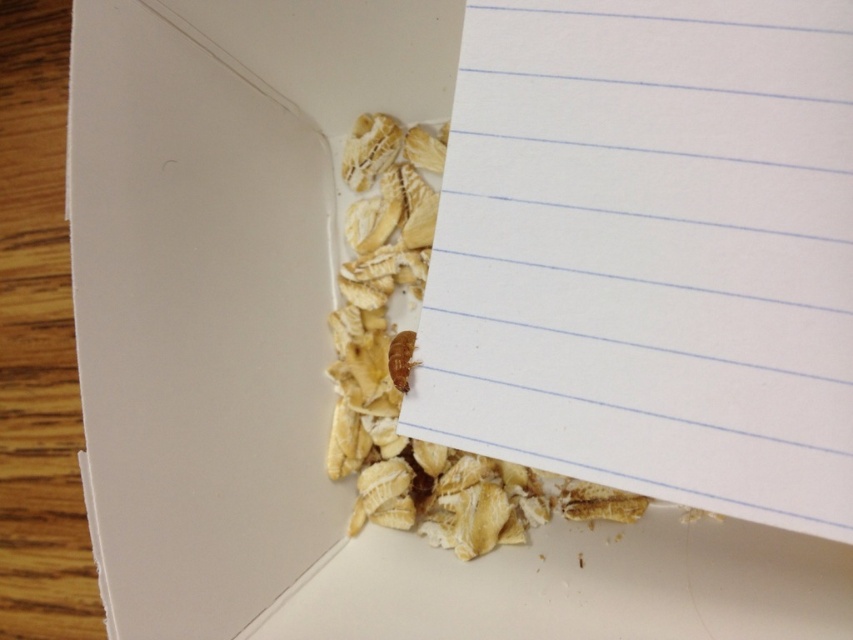
Question: From the image, what is the correct spatial relationship of white lined paper at center in relation to brown crumb at lower center?

Choices:
 (A) above
 (B) below

Answer: (A)

Question: Which point is closer to the camera?

Choices:
 (A) (579, 556)
 (B) (809, 188)
 (C) (398, 352)

Answer: (B)

Question: Can you confirm if white lined paper at center is positioned below brown crumb at lower center?

Choices:
 (A) no
 (B) yes

Answer: (A)

Question: Which object appears farthest from the camera in this image?

Choices:
 (A) brown crumb at lower center
 (B) brown matte nut at center
 (C) white lined paper at center

Answer: (A)

Question: Which object appears closest to the camera in this image?

Choices:
 (A) brown crumb at lower center
 (B) brown matte nut at center

Answer: (B)

Question: Does white lined paper at center appear under brown crumb at lower center?

Choices:
 (A) yes
 (B) no

Answer: (B)